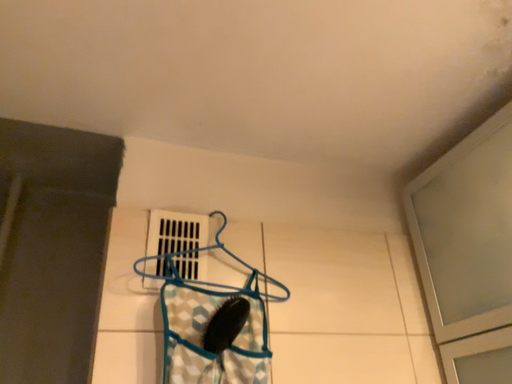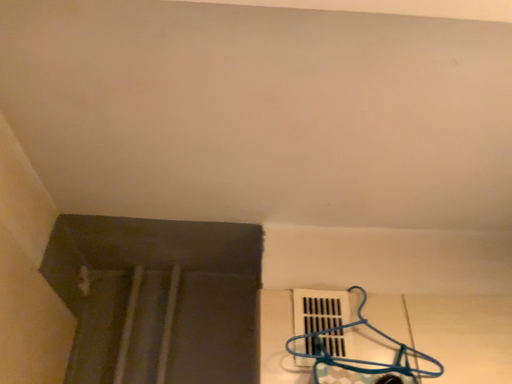
Question: How did the camera likely rotate when shooting the video?

Choices:
 (A) rotated left
 (B) rotated right

Answer: (A)